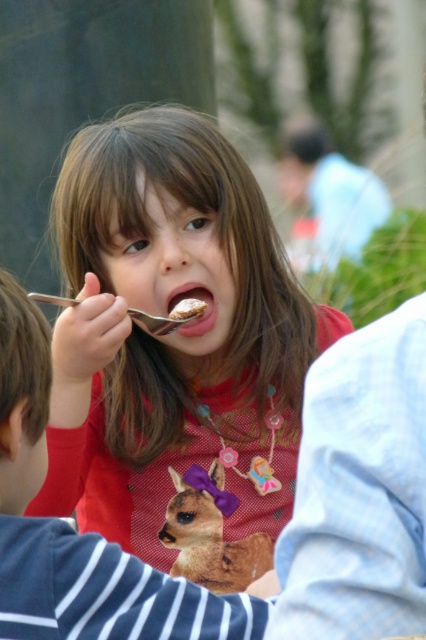
Question: Which point is closer to the camera?

Choices:
 (A) striped cotton shirt at lower left
 (B) pink matte flesh at mouth center
 (C) silver metallic fork at mouth

Answer: (A)

Question: Is matte red shirt at center closer to camera compared to striped cotton shirt at lower left?

Choices:
 (A) no
 (B) yes

Answer: (A)

Question: Which point appears farthest from the camera in this image?

Choices:
 (A) (166, 326)
 (B) (189, 305)
 (C) (184, 241)

Answer: (B)

Question: Which of these objects is positioned closest to the soft brown plush alpaca at center?

Choices:
 (A) white crumbly cake at mouth
 (B) silver metallic fork at mouth
 (C) matte red shirt at center

Answer: (C)

Question: Is matte red shirt at center positioned at the back of white crumbly cake at mouth?

Choices:
 (A) yes
 (B) no

Answer: (B)

Question: Is matte red shirt at center wider than soft brown plush alpaca at center?

Choices:
 (A) yes
 (B) no

Answer: (A)